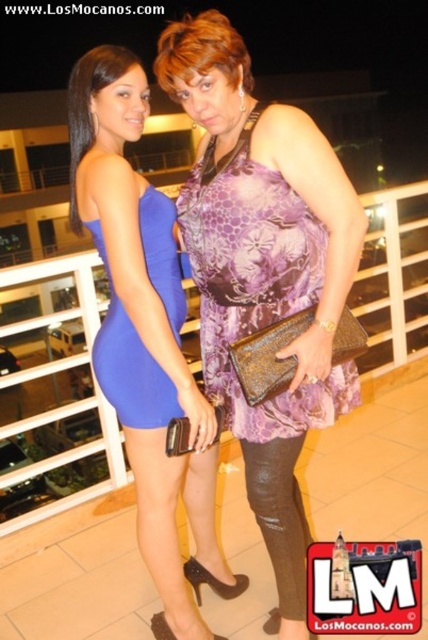
Question: Is matte blue dress at left above matte blue dress at center?

Choices:
 (A) no
 (B) yes

Answer: (A)

Question: Can you confirm if purple printed dress at center is wider than matte purple dress at center?

Choices:
 (A) no
 (B) yes

Answer: (B)

Question: Which of the following is the closest to the observer?

Choices:
 (A) matte purple dress at center
 (B) matte blue dress at center

Answer: (A)

Question: Based on their relative distances, which object is nearer to the purple printed dress at center?

Choices:
 (A) leather textured leggings at lower center
 (B) matte blue dress at left
 (C) blue satin dress at center
 (D) purple floral fabric dress at center

Answer: (D)

Question: Considering the real-world distances, which object is closest to the blue satin dress at center?

Choices:
 (A) leather textured leggings at lower center
 (B) matte blue dress at center
 (C) purple floral fabric dress at center

Answer: (C)

Question: Can you confirm if purple printed dress at center is smaller than blue satin dress at center?

Choices:
 (A) yes
 (B) no

Answer: (B)